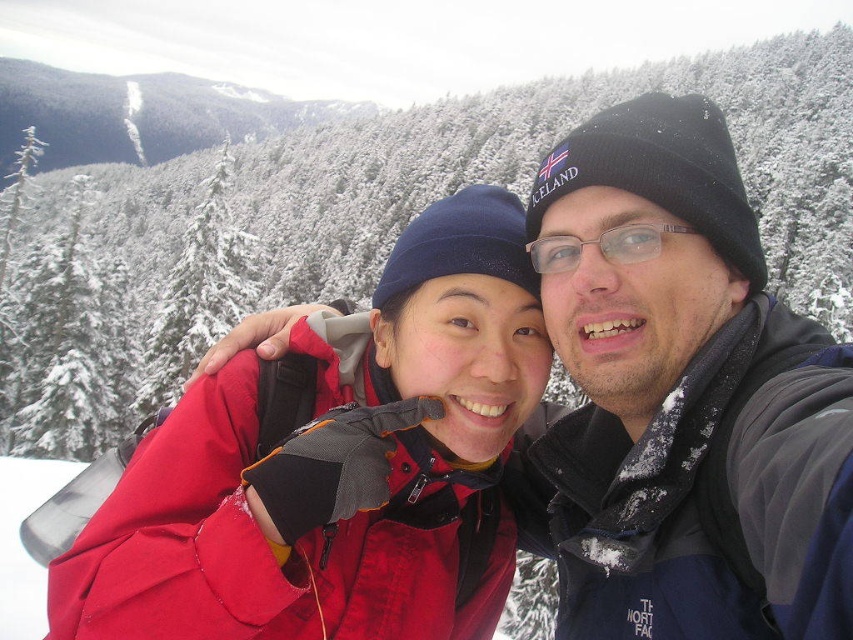
Question: Among these objects, which one is farthest from the camera?

Choices:
 (A) black knit hat at upper right
 (B) transparent plastic glasses at center

Answer: (B)

Question: Is black knit hat at upper right further to camera compared to matte red jacket at center?

Choices:
 (A) yes
 (B) no

Answer: (A)

Question: Which point appears closest to the camera in this image?

Choices:
 (A) (630, 625)
 (B) (488, 579)

Answer: (A)

Question: Considering the real-world distances, which object is farthest from the matte red jacket at center?

Choices:
 (A) black knit hat at upper right
 (B) transparent plastic glasses at center

Answer: (A)

Question: Can you confirm if black knit hat at upper right is bigger than matte red jacket at center?

Choices:
 (A) no
 (B) yes

Answer: (A)

Question: Is black knit hat at upper right positioned before matte red jacket at center?

Choices:
 (A) no
 (B) yes

Answer: (A)